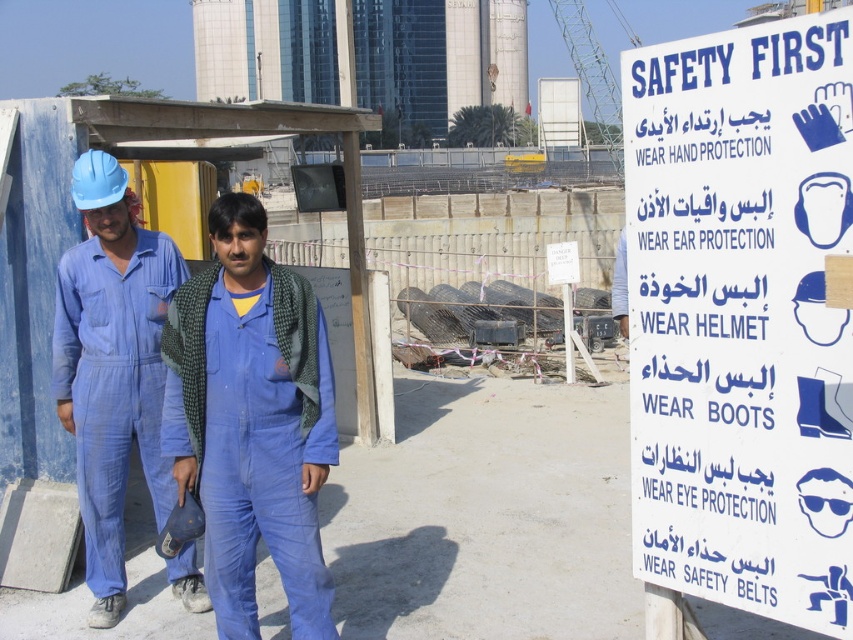
Which is more to the right, white paper sign at upper right or blue fabric jumpsuit at center?

Positioned to the right is white paper sign at upper right.

Can you confirm if white paper sign at upper right is positioned above blue fabric jumpsuit at center?

Indeed, white paper sign at upper right is positioned over blue fabric jumpsuit at center.

Does point (646, 257) lie in front of point (93, 620)?

That is True.

Image resolution: width=853 pixels, height=640 pixels. Identify the location of white paper sign at upper right. (741, 316).

Is white paper sign at upper right smaller than blue matte jumpsuit at center?

Actually, white paper sign at upper right might be larger than blue matte jumpsuit at center.

From the picture: Who is positioned more to the right, white paper sign at upper right or blue matte jumpsuit at center?

From the viewer's perspective, white paper sign at upper right appears more on the right side.

Image resolution: width=853 pixels, height=640 pixels. What are the coordinates of `white paper sign at upper right` in the screenshot? It's located at (741, 316).

Where is `white paper sign at upper right`? white paper sign at upper right is located at coordinates (741, 316).

You are a GUI agent. You are given a task and a screenshot of the screen. Output one action in this format:
    pyautogui.click(x=<x>, y=<y>)
    Task: Click on the blue matte jumpsuit at center
    
    Given the screenshot: What is the action you would take?
    pyautogui.click(x=251, y=420)